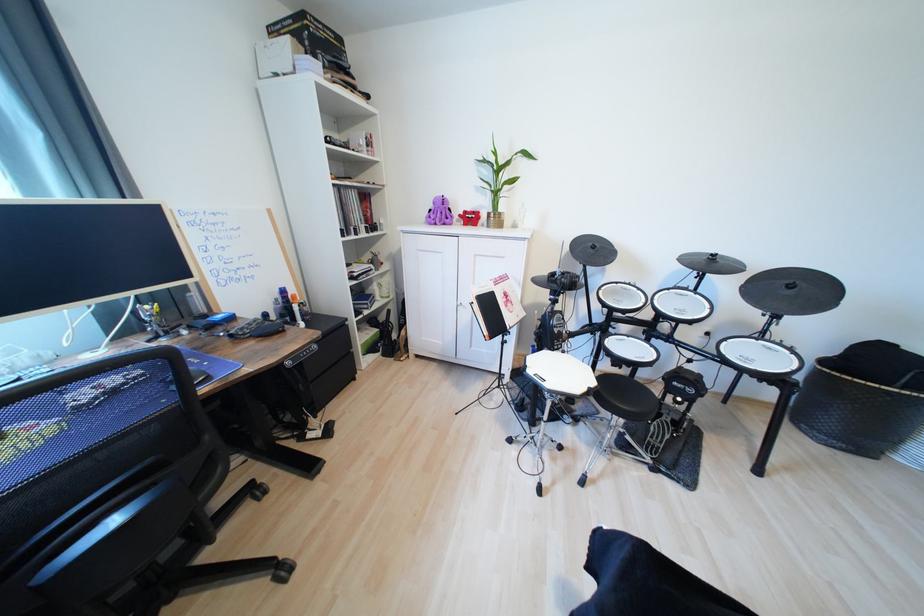
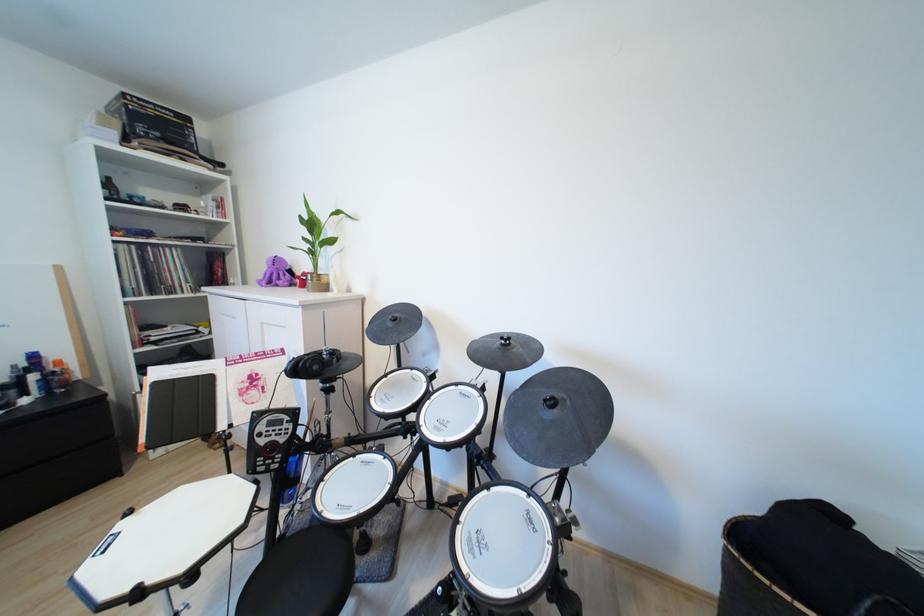
The point at (472, 214) is marked in the first image. Where is the corresponding point in the second image?

(310, 275)